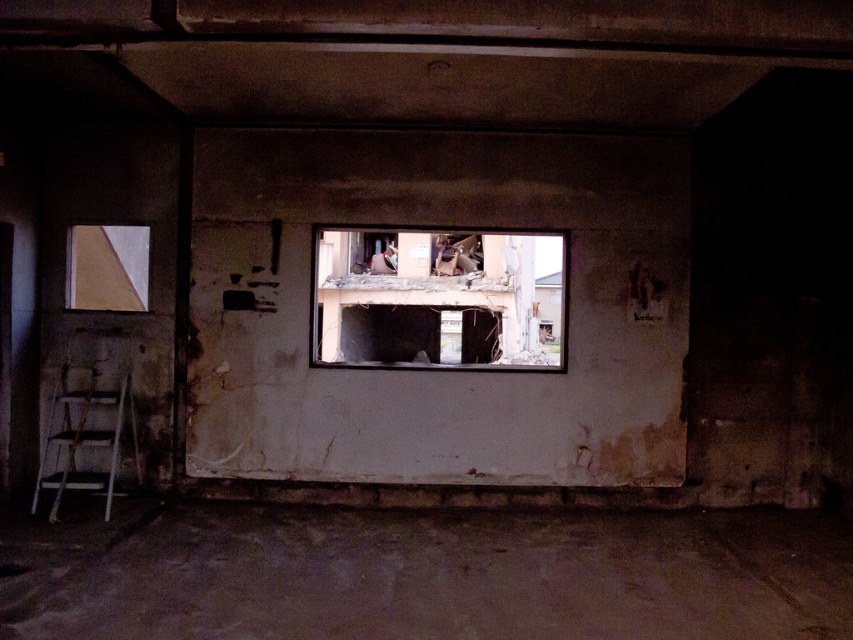
You are standing in the center of the room and want to take a photo of both the point at coordinates (141, 248) and the point at coordinates (73, 486). Which point will appear closer to the camera in the photo?

The point at coordinates (73, 486) will appear closer to the camera in the photo because it is physically closer to the camera than the point at coordinates (141, 248).

You are standing in the room and want to look through the transparent glass window at center. Where exactly should you position yourself to see the window clearly?

You should position yourself at point (438, 298) to see the transparent glass window at center clearly.

You are standing in the room described in the scene. There is a point marked at coordinates (438,298). What object does this point correspond to?

The point corresponds to the transparent glass window at center.